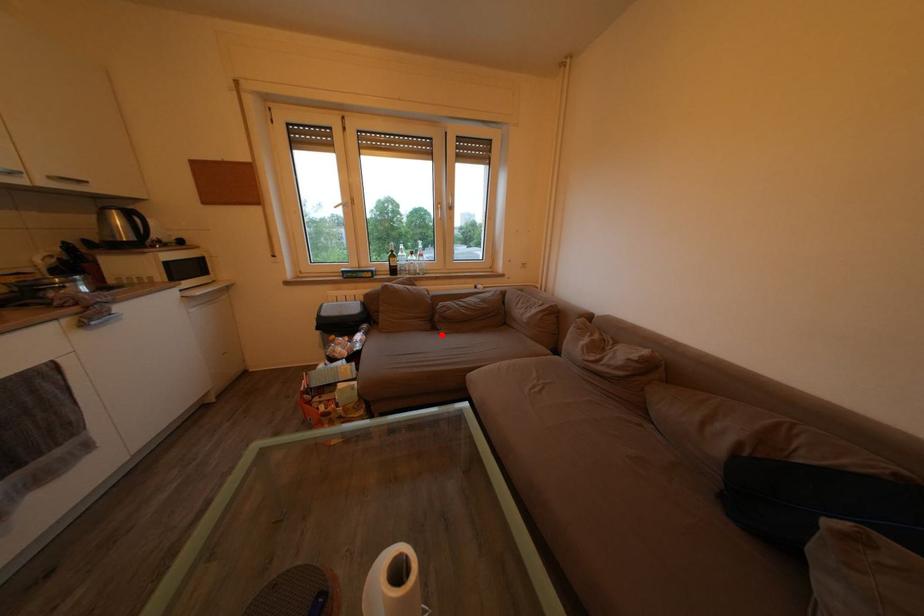
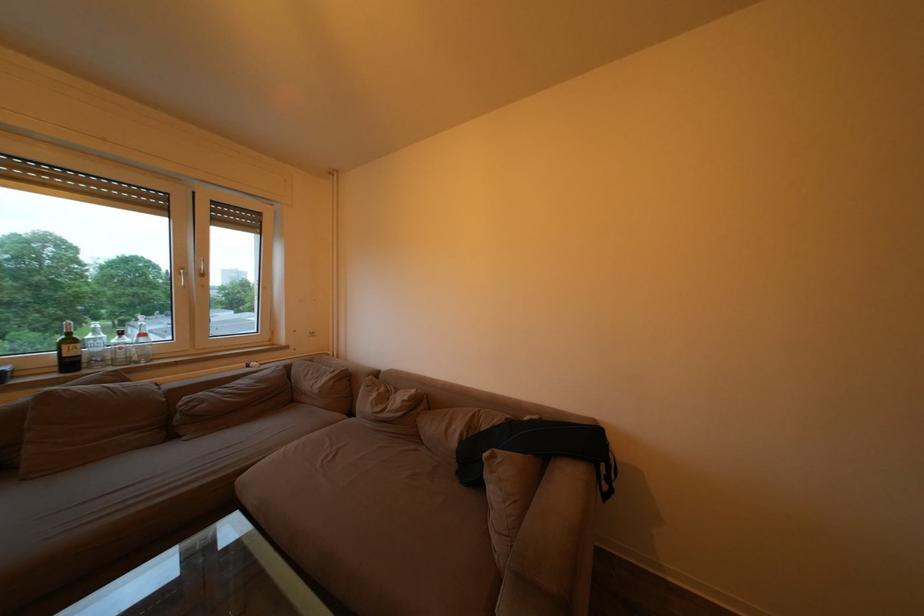
Question: I am providing you with two images of the same scene from different viewpoints. In image1, a red point is highlighted. Considering the same 3D point in image2, which of the following is correct?

Choices:
 (A) It is closer
 (B) It is farther

Answer: (A)